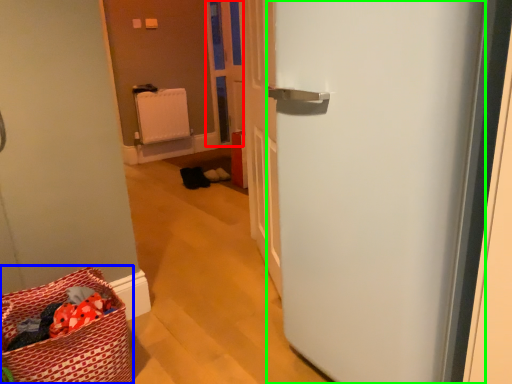
Question: Considering the real-world distances, which object is farthest from screen door (highlighted by a red box)? laundry basket (highlighted by a blue box) or door (highlighted by a green box)?

Choices:
 (A) laundry basket
 (B) door

Answer: (B)